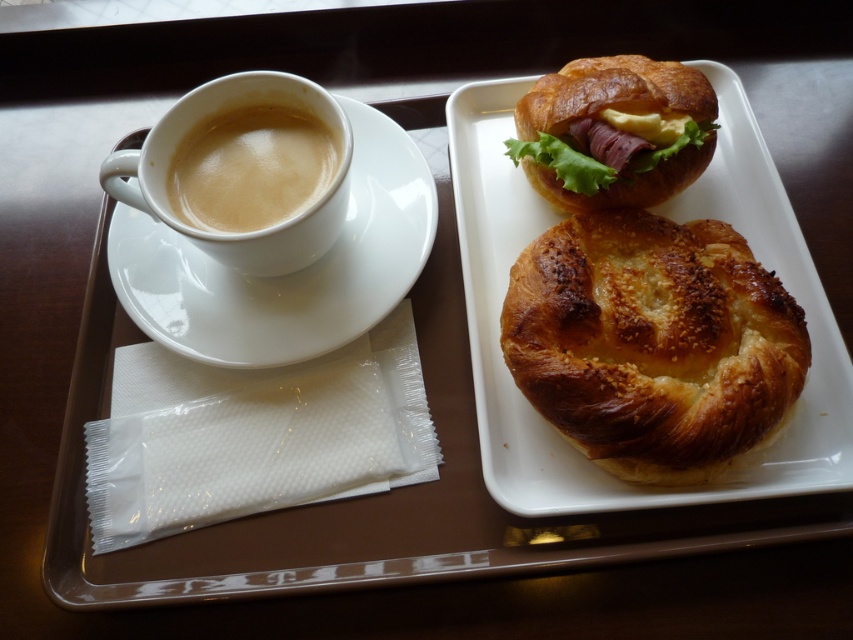
Question: Which of these objects is positioned farthest from the golden brown bread at upper center?

Choices:
 (A) white glossy saucer at upper left
 (B) golden brown flaky pastry at center
 (C) golden brown croissant at upper center

Answer: (A)

Question: Is golden brown flaky pastry at center positioned before golden brown bread at upper center?

Choices:
 (A) no
 (B) yes

Answer: (B)

Question: Estimate the real-world distances between objects in this image. Which object is closer to the golden brown bread at upper center?

Choices:
 (A) golden brown croissant at upper center
 (B) golden brown flaky pastry at center
 (C) white glossy saucer at upper left
 (D) matte white cup at upper left

Answer: (B)

Question: Is golden brown bread at upper center closer to the viewer compared to white glossy saucer at upper left?

Choices:
 (A) no
 (B) yes

Answer: (B)

Question: Which is farther from the white glossy saucer at upper left?

Choices:
 (A) golden brown bread at upper center
 (B) golden brown croissant at upper center

Answer: (B)

Question: Is golden brown flaky pastry at center further to the viewer compared to golden brown croissant at upper center?

Choices:
 (A) yes
 (B) no

Answer: (B)